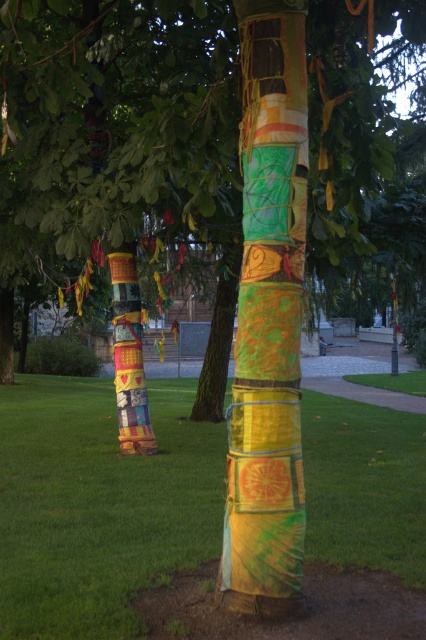
Question: Does green grass at lower center appear on the left side of multicolored fabric wrapped tree trunk at center?

Choices:
 (A) no
 (B) yes

Answer: (A)

Question: Which point is closer to the camera taking this photo?

Choices:
 (A) click(279, 337)
 (B) click(121, 428)

Answer: (A)

Question: Based on their relative distances, which object is farther from the textured fabric pillar at center?

Choices:
 (A) textured fabric tree at center
 (B) multicolored fabric wrapped tree trunk at center
 (C) green grass at lower center

Answer: (B)

Question: Is textured fabric tree at center positioned before multicolored fabric wrapped tree trunk at center?

Choices:
 (A) yes
 (B) no

Answer: (A)

Question: Can you confirm if textured fabric tree at center is positioned to the left of green grass at lower center?

Choices:
 (A) yes
 (B) no

Answer: (B)

Question: Among these objects, which one is farthest from the camera?

Choices:
 (A) textured fabric tree at center
 (B) textured fabric pillar at center

Answer: (A)